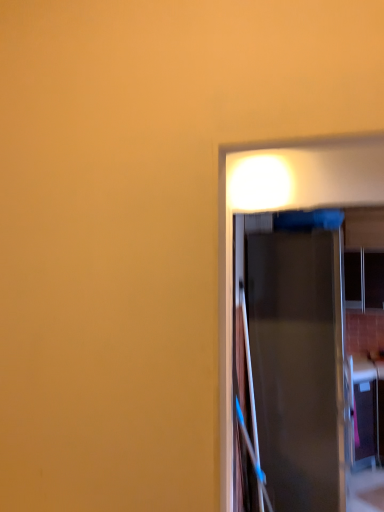
Question: From a real-world perspective, relative to transparent glass window at right, is metallic silver door at center vertically above or below?

Choices:
 (A) below
 (B) above

Answer: (A)

Question: Looking at the image, does metallic silver door at center seem bigger or smaller compared to transparent glass window at right?

Choices:
 (A) big
 (B) small

Answer: (A)

Question: Considering the positions of point (251, 356) and point (375, 260), is point (251, 356) closer or farther from the camera than point (375, 260)?

Choices:
 (A) closer
 (B) farther

Answer: (A)

Question: Is transparent glass window at right situated inside metallic silver door at center or outside?

Choices:
 (A) inside
 (B) outside

Answer: (B)

Question: From a real-world perspective, is transparent glass window at right physically located above or below metallic silver door at center?

Choices:
 (A) above
 (B) below

Answer: (A)

Question: From the image's perspective, is transparent glass window at right located above or below metallic silver door at center?

Choices:
 (A) below
 (B) above

Answer: (B)

Question: Is transparent glass window at right wider or thinner than metallic silver door at center?

Choices:
 (A) thin
 (B) wide

Answer: (A)